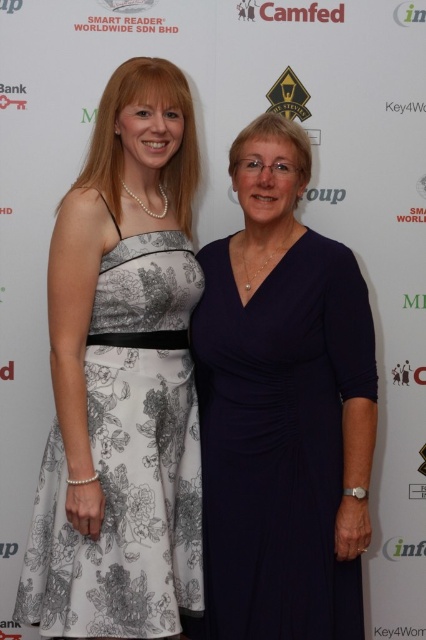
Question: Where is navy blue dress at center located in relation to white floral fabric dress at left in the image?

Choices:
 (A) right
 (B) left

Answer: (A)

Question: From the image, what is the correct spatial relationship of navy blue dress at center in relation to white floral fabric dress at left?

Choices:
 (A) above
 (B) below

Answer: (A)

Question: Is navy blue dress at center behind white floral fabric dress at left?

Choices:
 (A) no
 (B) yes

Answer: (B)

Question: Among these objects, which one is farthest from the camera?

Choices:
 (A) white floral fabric dress at left
 (B) navy blue dress at center

Answer: (B)